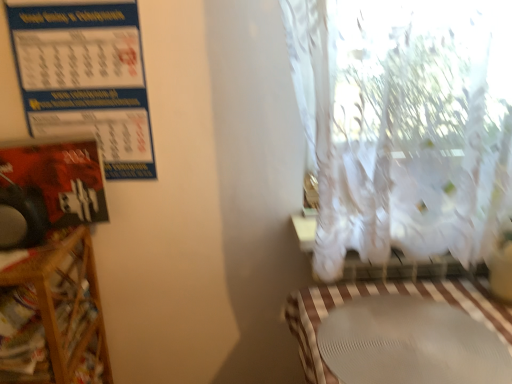
Question: Considering the relative sizes of wooden shelf at left and white matte table at lower right in the image provided, is wooden shelf at left wider than white matte table at lower right?

Choices:
 (A) no
 (B) yes

Answer: (A)

Question: Can you confirm if wooden shelf at left is taller than white matte table at lower right?

Choices:
 (A) no
 (B) yes

Answer: (B)

Question: Would you say wooden shelf at left is outside white matte table at lower right?

Choices:
 (A) no
 (B) yes

Answer: (B)

Question: Can you confirm if wooden shelf at left is shorter than white matte table at lower right?

Choices:
 (A) no
 (B) yes

Answer: (A)

Question: Is white matte table at lower right at the back of wooden shelf at left?

Choices:
 (A) no
 (B) yes

Answer: (A)

Question: Is white matte table at lower right bigger or smaller than wooden shelf at left?

Choices:
 (A) small
 (B) big

Answer: (A)

Question: Is white matte table at lower right spatially inside wooden shelf at left, or outside of it?

Choices:
 (A) inside
 (B) outside

Answer: (B)

Question: Does point (374, 281) appear closer or farther from the camera than point (87, 357)?

Choices:
 (A) closer
 (B) farther

Answer: (A)

Question: From the image's perspective, is white matte table at lower right positioned above or below wooden shelf at left?

Choices:
 (A) above
 (B) below

Answer: (A)

Question: From their relative heights in the image, would you say wooden shelf at left is taller or shorter than blue paper calendar at upper left?

Choices:
 (A) short
 (B) tall

Answer: (B)

Question: Relative to blue paper calendar at upper left, is wooden shelf at left in front or behind?

Choices:
 (A) behind
 (B) front

Answer: (B)

Question: Is wooden shelf at left to the left or to the right of blue paper calendar at upper left in the image?

Choices:
 (A) right
 (B) left

Answer: (B)

Question: Does point (11, 269) appear closer or farther from the camera than point (79, 79)?

Choices:
 (A) closer
 (B) farther

Answer: (A)

Question: From their relative heights in the image, would you say wooden shelf at left is taller or shorter than white matte table at lower right?

Choices:
 (A) short
 (B) tall

Answer: (B)

Question: Choose the correct answer: Is wooden shelf at left inside white matte table at lower right or outside it?

Choices:
 (A) inside
 (B) outside

Answer: (B)